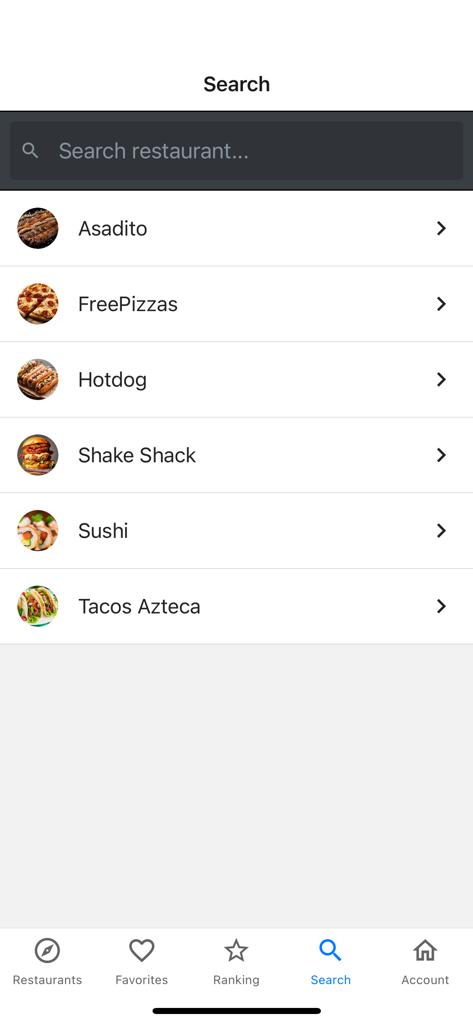
Locate an element on the screen. The width and height of the screenshot is (473, 1024). small round "profile style" photos is located at coordinates (42, 229), (30, 300), (42, 382), (40, 453), (44, 531), (43, 603).